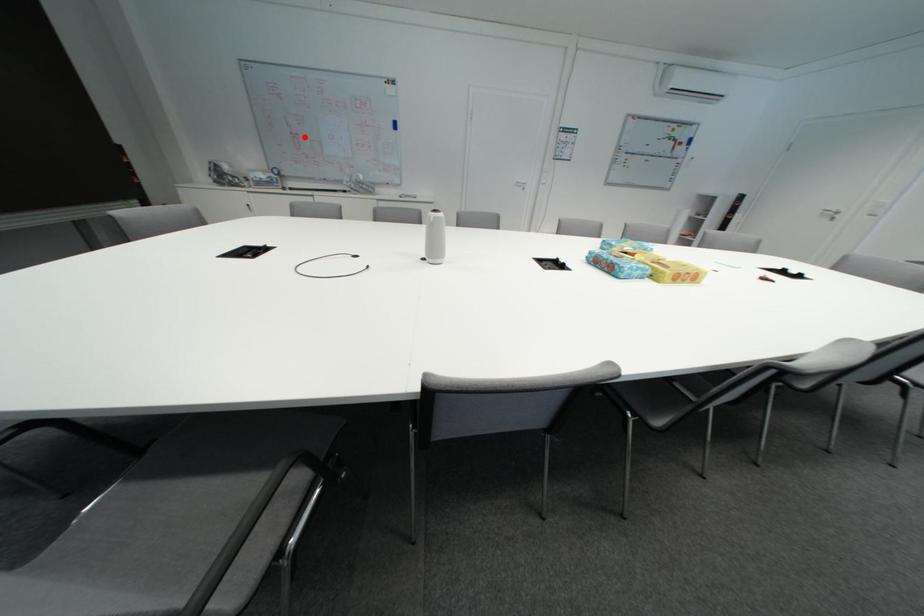
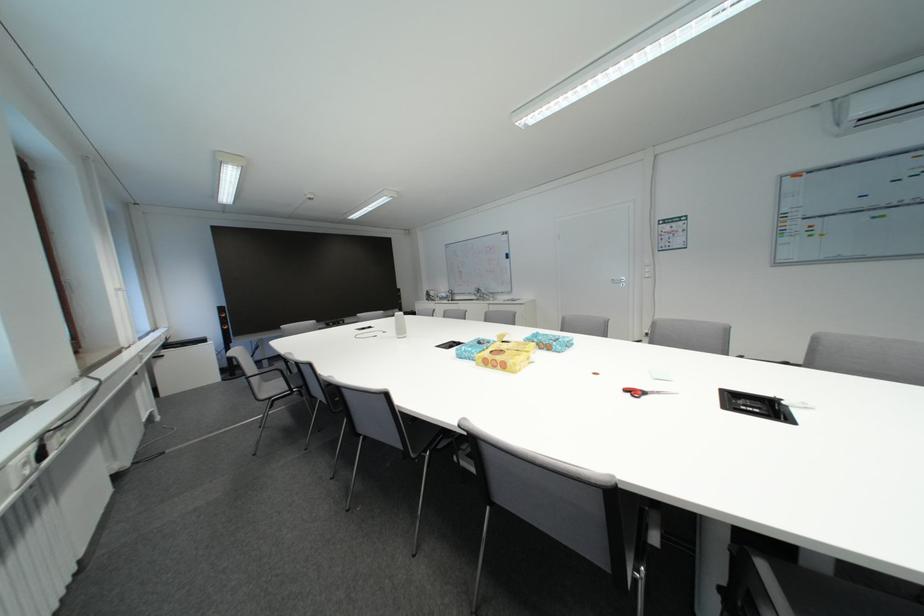
The point at the highlighted location is marked in the first image. Where is the corresponding point in the second image?

(470, 275)